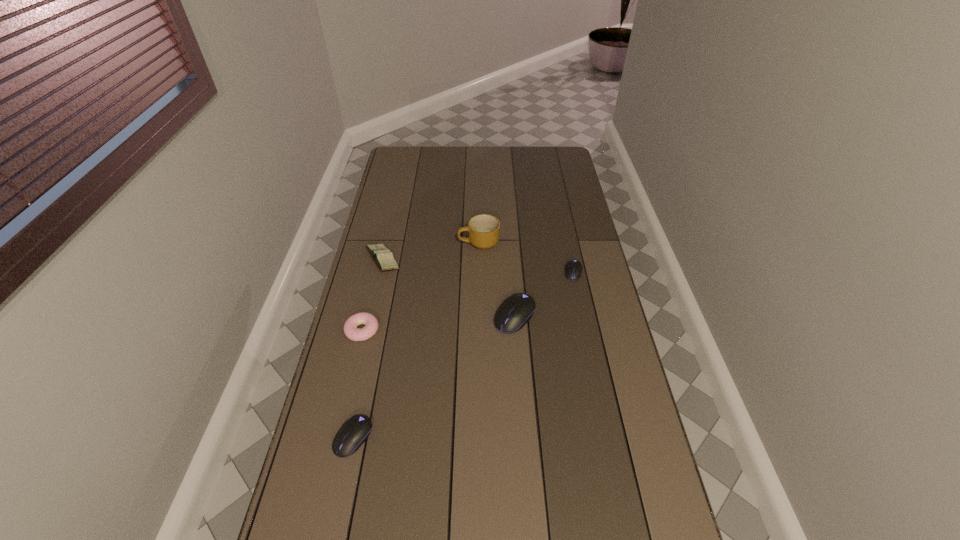
In order to click on object that is at the right edge in this screenshot , I will do `click(573, 272)`.

Locate an element on the screen. The height and width of the screenshot is (540, 960). vacant space at the far edge of the desktop is located at coordinates (533, 148).

Where is `vacant space at the near edge of the desktop`? This screenshot has width=960, height=540. vacant space at the near edge of the desktop is located at coordinates (398, 518).

This screenshot has width=960, height=540. What are the coordinates of `vacant space at the left edge of the desktop` in the screenshot? It's located at (370, 364).

Locate an element on the screen. This screenshot has width=960, height=540. vacant area at the right edge of the desktop is located at coordinates coord(588,278).

Where is `vacant space at the near left corner of the desktop`? vacant space at the near left corner of the desktop is located at coordinates (305, 532).

Where is `free spot between the doughnut and the second computer mouse from left to right`? The image size is (960, 540). free spot between the doughnut and the second computer mouse from left to right is located at coordinates (439, 323).

Find the location of a particular element. free area in between the second computer mouse from left to right and the doughnut is located at coordinates (439, 323).

Where is `vacant area between the doughnut and the rightmost object`? vacant area between the doughnut and the rightmost object is located at coordinates (468, 301).

Locate an element on the screen. This screenshot has width=960, height=540. free space that is in between the second tallest computer mouse and the diary is located at coordinates (368, 349).